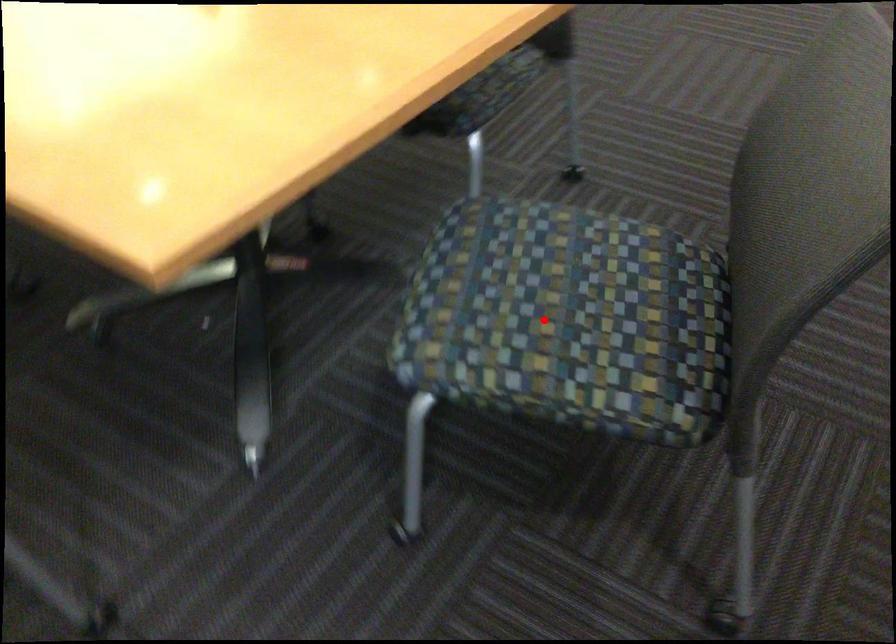
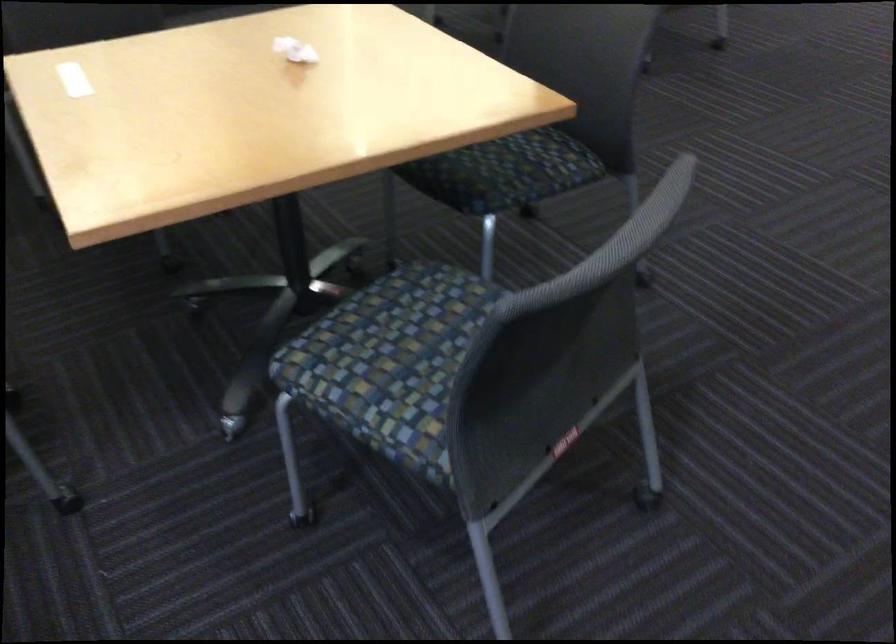
Question: I am providing you with two images of the same scene from different viewpoints. Image1 has a red point marked. In image2, the corresponding 3D location appears at what relative position? Reply with the corresponding letter.

Choices:
 (A) Closer
 (B) Farther

Answer: (B)